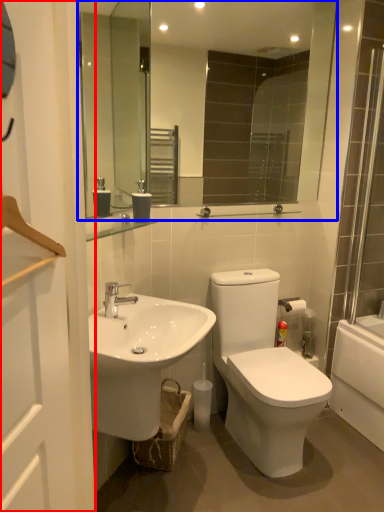
Question: Which object is further to the camera taking this photo, screen door (highlighted by a red box) or mirror (highlighted by a blue box)?

Choices:
 (A) screen door
 (B) mirror

Answer: (B)